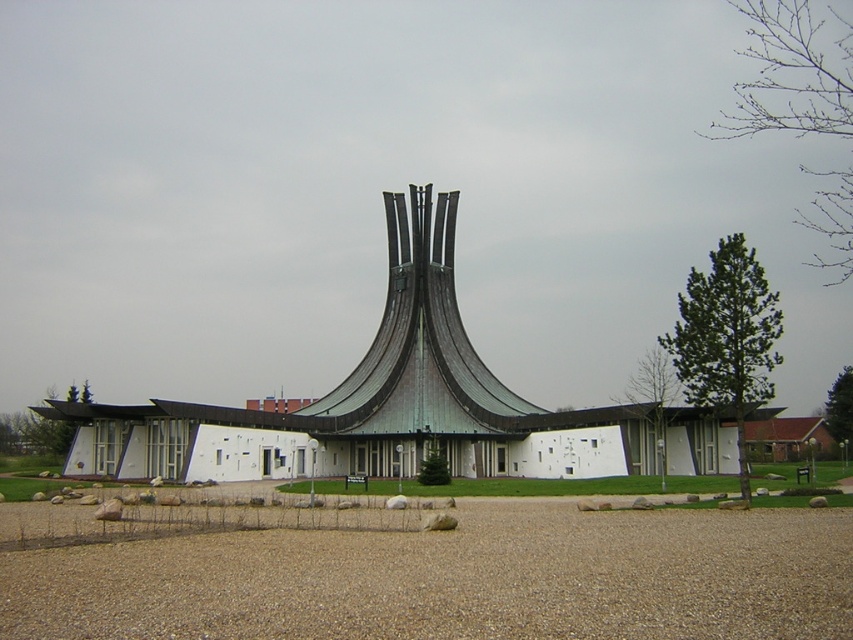
Who is shorter, brown gravel at lower center or white matte building at center?

Standing shorter between the two is brown gravel at lower center.

Is point (750, 592) closer to camera compared to point (405, 458)?

Yes, point (750, 592) is closer to viewer.

Does point (245, 593) lie in front of point (444, 396)?

Yes, point (245, 593) is closer to viewer.

Find the location of `brown gravel at lower center`. brown gravel at lower center is located at coordinates (456, 579).